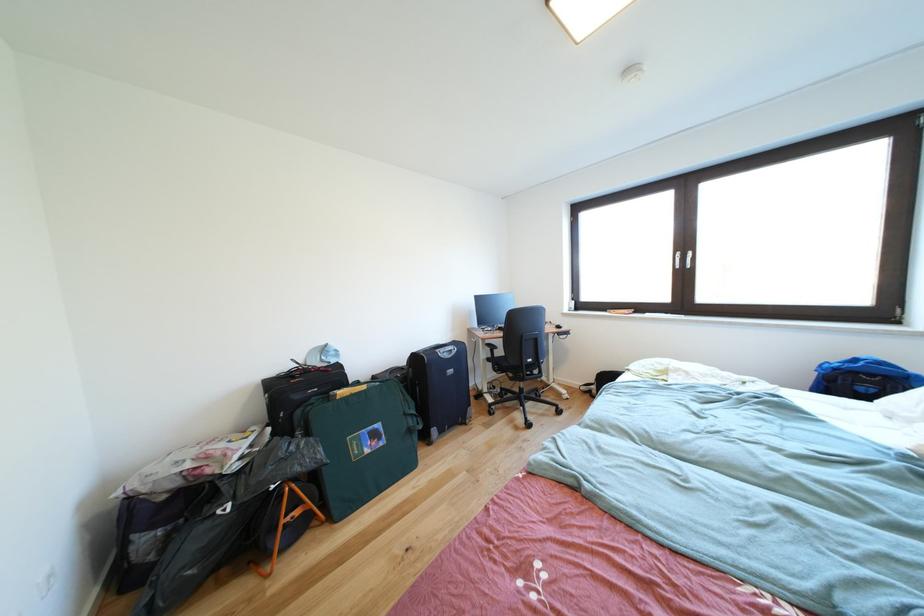
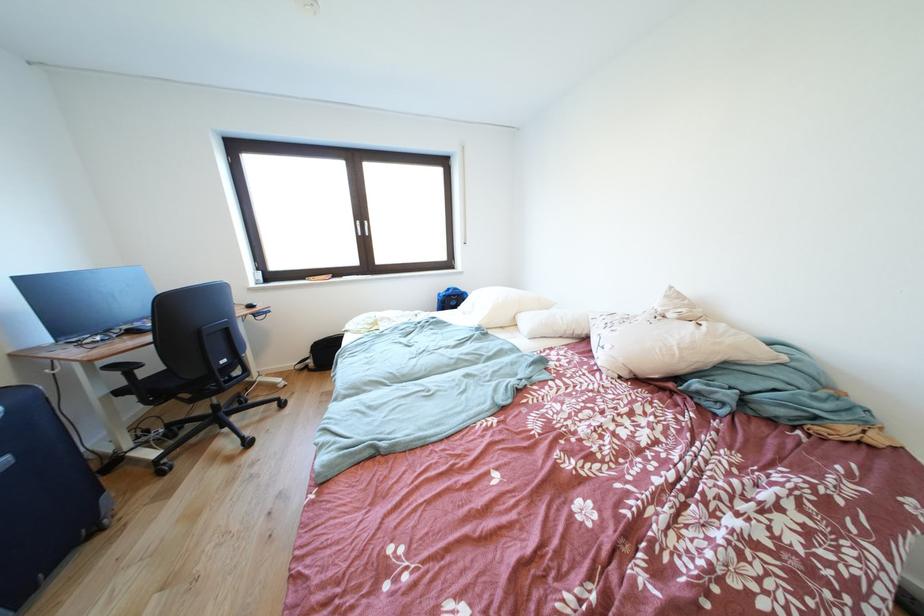
The point at (x=508, y=357) is marked in the first image. Where is the corresponding point in the second image?

(161, 373)